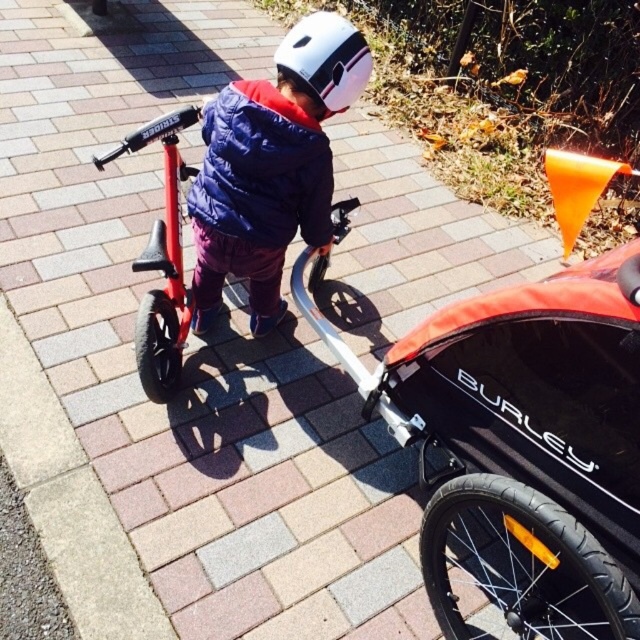
You are a parent trying to secure your child in the blue down jacket at center before they start riding the orange fabric baby carriage at center. Which item should you approach first to ensure safety?

The blue down jacket at center should be approached first because it is to the left of the orange fabric baby carriage at center, making it closer to your current position.

You are a photographer trying to capture a clear shot of both the shiny red bicycle at center and the white matte helmet at upper center. Since you want both objects in focus, which one should you adjust your camera focus on first to ensure the other is also in focus?

The shiny red bicycle at center is closer to the viewer than the white matte helmet at upper center. To ensure both are in focus, you should focus on the shiny red bicycle at center first, as it is closer, and the white matte helmet at upper center will naturally fall into focus beyond it.

You are a parent standing at the edge of the paved pathway. You want to check if your child can safely walk from the red balance bike to the orange fabric baby carriage at center without stepping on the rectangular bricks. The child needs a clear path of at least 0.5 meters. Can they do it?

The orange fabric baby carriage at center is 1.07 meters away from viewer. Since the child needs a clear path of at least 0.5 meters, the distance between the red balance bike and the orange fabric baby carriage at center is sufficient for the child to walk safely without stepping on the rectangular bricks.